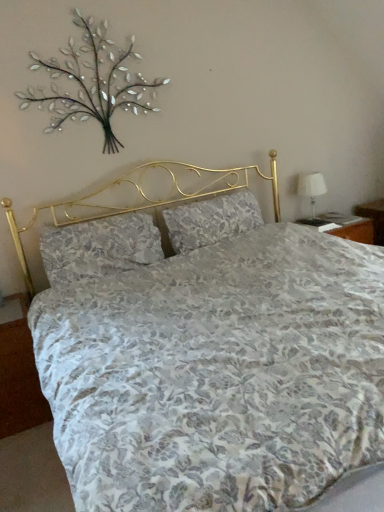
Question: Does white fabric lampshade at right have a greater width compared to floral fabric pillow at center, positioned as the 1th pillow in right-to-left order?

Choices:
 (A) yes
 (B) no

Answer: (B)

Question: Is white fabric lampshade at right oriented away from floral fabric pillow at center, which is counted as the 2th pillow, starting from the left?

Choices:
 (A) yes
 (B) no

Answer: (B)

Question: From a real-world perspective, is white fabric lampshade at right physically above floral fabric pillow at center, which is counted as the 2th pillow, starting from the left?

Choices:
 (A) no
 (B) yes

Answer: (A)

Question: Considering the relative positions of white fabric lampshade at right and floral fabric pillow at center, positioned as the 1th pillow in right-to-left order, in the image provided, is white fabric lampshade at right behind floral fabric pillow at center, positioned as the 1th pillow in right-to-left order,?

Choices:
 (A) no
 (B) yes

Answer: (B)

Question: From the image's perspective, is white fabric lampshade at right on floral fabric pillow at center, which is counted as the 2th pillow, starting from the left?

Choices:
 (A) no
 (B) yes

Answer: (B)

Question: Considering the relative sizes of white fabric lampshade at right and floral fabric pillow at center, which is counted as the 2th pillow, starting from the left, in the image provided, is white fabric lampshade at right shorter than floral fabric pillow at center, which is counted as the 2th pillow, starting from the left,?

Choices:
 (A) no
 (B) yes

Answer: (A)

Question: Does white fabric lampshade at right have a lesser width compared to metallic silver branches at upper left?

Choices:
 (A) no
 (B) yes

Answer: (A)

Question: Is metallic silver branches at upper left at the back of white fabric lampshade at right?

Choices:
 (A) no
 (B) yes

Answer: (A)

Question: Is white fabric lampshade at right closer to camera compared to metallic silver branches at upper left?

Choices:
 (A) yes
 (B) no

Answer: (B)

Question: From the image's perspective, does white fabric lampshade at right appear lower than metallic silver branches at upper left?

Choices:
 (A) no
 (B) yes

Answer: (B)

Question: Is white fabric lampshade at right placed right next to metallic silver branches at upper left?

Choices:
 (A) no
 (B) yes

Answer: (A)

Question: Could you tell me if white fabric lampshade at right is turned towards metallic silver branches at upper left?

Choices:
 (A) yes
 (B) no

Answer: (B)

Question: Does metallic silver branches at upper left have a larger size compared to white fabric lampshade at right?

Choices:
 (A) yes
 (B) no

Answer: (A)